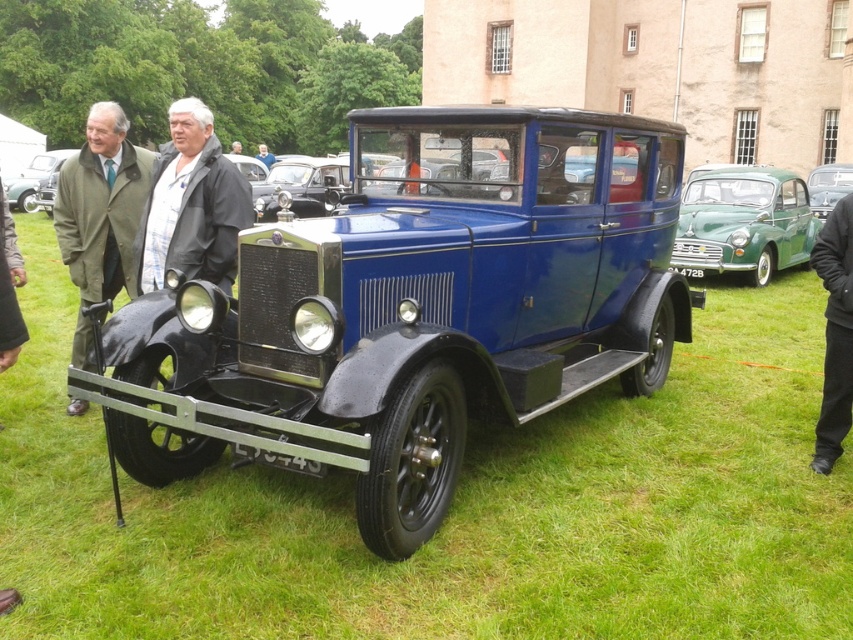
Question: Which point is closer to the camera?

Choices:
 (A) (509, 145)
 (B) (59, 196)
 (C) (844, 202)
 (D) (805, 220)

Answer: (C)

Question: Is green fabric coat at left above light blue fabric jacket at center?

Choices:
 (A) no
 (B) yes

Answer: (A)

Question: Among these objects, which one is farthest from the camera?

Choices:
 (A) light blue fabric jacket at center
 (B) green matte car at right

Answer: (A)

Question: Where is green fabric coat at left located in relation to light blue fabric jacket at center in the image?

Choices:
 (A) left
 (B) right

Answer: (A)

Question: Considering the relative positions of black fabric jacket at center and green matte car at right in the image provided, where is black fabric jacket at center located with respect to green matte car at right?

Choices:
 (A) below
 (B) above

Answer: (A)

Question: Among these points, which one is farthest from the camera?

Choices:
 (A) (86, 291)
 (B) (833, 317)
 (C) (775, 195)

Answer: (C)